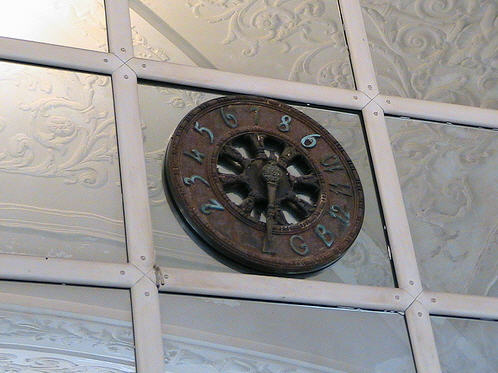
Where is `white thin pieces of wood on wall`? white thin pieces of wood on wall is located at coordinates (129, 155), (277, 80), (294, 292), (470, 299), (377, 206), (147, 231), (122, 20), (71, 52).